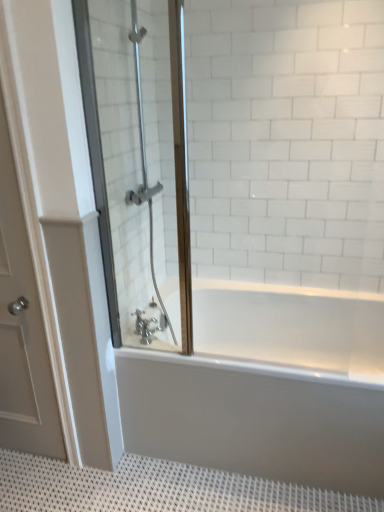
The height and width of the screenshot is (512, 384). Identify the location of white glossy bathtub at center. (266, 387).

What are the coordinates of `white matte door at left` in the screenshot? It's located at (22, 329).

The width and height of the screenshot is (384, 512). What do you see at coordinates (145, 327) in the screenshot?
I see `chrome metallic faucet at lower center` at bounding box center [145, 327].

Identify the location of chrome metallic faucet at lower center. (145, 327).

You are a GUI agent. You are given a task and a screenshot of the screen. Output one action in this format:
    pyautogui.click(x=<x>, y=<y>)
    Task: Click on the white glossy bathtub at center
    Image resolution: width=384 pixels, height=512 pixels.
    Given the screenshot: What is the action you would take?
    pyautogui.click(x=266, y=387)

Would you say white matte door at left is outside clear glass shower door at left?

Yes, white matte door at left is located beyond the bounds of clear glass shower door at left.

Who is bigger, white matte door at left or clear glass shower door at left?

Bigger between the two is white matte door at left.

Is white matte door at left wider than clear glass shower door at left?

Incorrect, the width of white matte door at left does not surpass that of clear glass shower door at left.

From the image's perspective, between white matte door at left and clear glass shower door at left, who is located below?

white matte door at left.

From a real-world perspective, is clear glass shower door at left on top of chrome metallic faucet at lower center?

Indeed, from a real-world perspective, clear glass shower door at left stands above chrome metallic faucet at lower center.

From the image's perspective, does clear glass shower door at left appear lower than chrome metallic faucet at lower center?

No, from the image's perspective, clear glass shower door at left is not beneath chrome metallic faucet at lower center.

Is clear glass shower door at left next to chrome metallic faucet at lower center and touching it?

They are not placed beside each other.

Is clear glass shower door at left oriented away from chrome metallic faucet at lower center?

Yes.

Is white matte door at left positioned with its back to white glossy bathtub at center?

white matte door at left is not turned away from white glossy bathtub at center.

Is white matte door at left taller than white glossy bathtub at center?

Indeed, white matte door at left has a greater height compared to white glossy bathtub at center.

Is white matte door at left thinner than white glossy bathtub at center?

Indeed, white matte door at left has a lesser width compared to white glossy bathtub at center.

From a real-world perspective, is white matte door at left located higher than white glossy bathtub at center?

Yes.

Which is behind, clear glass shower door at left or white matte door at left?

white matte door at left.

From a real-world perspective, is clear glass shower door at left under white matte door at left?

No.

Is clear glass shower door at left to the left or to the right of white matte door at left in the image?

clear glass shower door at left is to the right of white matte door at left.

The width and height of the screenshot is (384, 512). There is a white matte door at left. What are the coordinates of `shower door above it (from a real-world perspective)` in the screenshot? It's located at (139, 161).

Would you say clear glass shower door at left is to the left or to the right of white textured bath mat at lower center in the picture?

Based on their positions, clear glass shower door at left is located to the left of white textured bath mat at lower center.

Is clear glass shower door at left not close to white textured bath mat at lower center?

That's right, there is a large distance between clear glass shower door at left and white textured bath mat at lower center.

Find the location of a particular element. Image resolution: width=384 pixels, height=512 pixels. shower door above the white textured bath mat at lower center (from the image's perspective) is located at coordinates (139, 161).

How much distance is there between clear glass shower door at left and white textured bath mat at lower center?

clear glass shower door at left and white textured bath mat at lower center are 3.91 feet apart.

Does chrome metallic faucet at lower center have a greater width compared to clear glass shower door at left?

Incorrect, the width of chrome metallic faucet at lower center does not surpass that of clear glass shower door at left.

Is chrome metallic faucet at lower center far from clear glass shower door at left?

They are positioned close to each other.

Considering the sizes of objects chrome metallic faucet at lower center and clear glass shower door at left in the image provided, who is shorter, chrome metallic faucet at lower center or clear glass shower door at left?

chrome metallic faucet at lower center is shorter.

Considering the sizes of objects chrome metallic faucet at lower center and clear glass shower door at left in the image provided, who is bigger, chrome metallic faucet at lower center or clear glass shower door at left?

clear glass shower door at left.

Does point (9, 450) come behind point (177, 166)?

Yes, it is behind point (177, 166).

Which is more to the left, white textured bath mat at lower center or clear glass shower door at left?

From the viewer's perspective, clear glass shower door at left appears more on the left side.

In the scene shown: Can you tell me how much white textured bath mat at lower center and clear glass shower door at left differ in facing direction?

white textured bath mat at lower center and clear glass shower door at left are facing 90 degrees away from each other.

Which of these two, white textured bath mat at lower center or clear glass shower door at left, is thinner?

clear glass shower door at left is thinner.

Image resolution: width=384 pixels, height=512 pixels. What are the coordinates of `shower door on the right of white matte door at left` in the screenshot? It's located at (139, 161).

The image size is (384, 512). What are the coordinates of `shower door that appears above the chrome metallic faucet at lower center (from the image's perspective)` in the screenshot? It's located at (139, 161).

Looking at the image, which one is located further to clear glass shower door at left, white textured bath mat at lower center or white glossy bathtub at center?

white textured bath mat at lower center lies further to clear glass shower door at left than the other object.

Which object lies nearer to the anchor point clear glass shower door at left, white matte door at left or white textured bath mat at lower center?

Based on the image, white matte door at left appears to be nearer to clear glass shower door at left.

When comparing their distances from chrome metallic faucet at lower center, does white glossy bathtub at center or white matte door at left seem closer?

The object closer to chrome metallic faucet at lower center is white glossy bathtub at center.

From the image, which object appears to be nearer to white glossy bathtub at center, chrome metallic faucet at lower center or white matte door at left?

chrome metallic faucet at lower center lies closer to white glossy bathtub at center than the other object.

Estimate the real-world distances between objects in this image. Which object is closer to clear glass shower door at left, white glossy bathtub at center or white matte door at left?

The object closer to clear glass shower door at left is white matte door at left.

Estimate the real-world distances between objects in this image. Which object is further from clear glass shower door at left, white glossy bathtub at center or white textured bath mat at lower center?

Among the two, white textured bath mat at lower center is located further to clear glass shower door at left.

Based on their spatial positions, is clear glass shower door at left or white matte door at left further from chrome metallic faucet at lower center?

clear glass shower door at left is positioned further to the anchor chrome metallic faucet at lower center.

Looking at the image, which one is located further to white textured bath mat at lower center, clear glass shower door at left or white matte door at left?

clear glass shower door at left is positioned further to the anchor white textured bath mat at lower center.

Image resolution: width=384 pixels, height=512 pixels. Identify the location of shower door between white matte door at left and white glossy bathtub at center in the horizontal direction. pyautogui.click(x=139, y=161).

Locate an element on the screen. The width and height of the screenshot is (384, 512). bathtub between chrome metallic faucet at lower center and white textured bath mat at lower center in the vertical direction is located at coordinates (266, 387).

At what (x,y) coordinates should I click in order to perform the action: click on door between clear glass shower door at left and white textured bath mat at lower center in the vertical direction. Please return your answer as a coordinate pair (x, y). The width and height of the screenshot is (384, 512). Looking at the image, I should click on (22, 329).

Find the location of a particular element. The height and width of the screenshot is (512, 384). tap between white matte door at left and clear glass shower door at left is located at coordinates (145, 327).